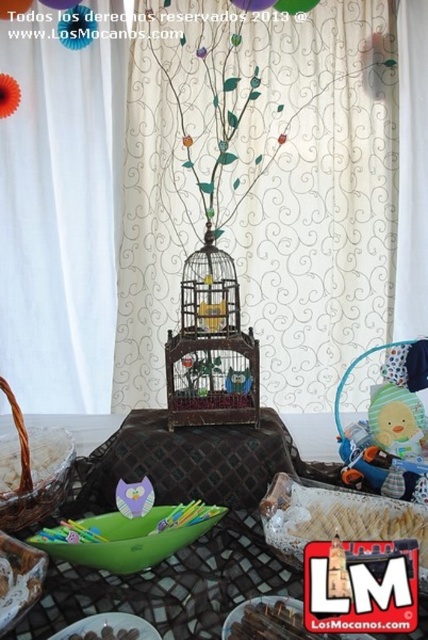
Is point (225, 253) farther from viewer compared to point (56, 3)?

That is False.

Measure the distance between metallic wire birdcage at center and translucent paper balloon at upper left.

metallic wire birdcage at center and translucent paper balloon at upper left are 5.40 feet apart from each other.

Who is more forward, (204, 259) or (53, 0)?

Point (204, 259)

Identify the location of metallic wire birdcage at center. The width and height of the screenshot is (428, 640). (211, 346).

Who is positioned more to the left, white paper balloon at upper center or purple paper balloon at upper center?

white paper balloon at upper center

Does white paper balloon at upper center appear on the left side of purple paper balloon at upper center?

Indeed, white paper balloon at upper center is positioned on the left side of purple paper balloon at upper center.

Who is more distant from viewer, (5, 8) or (258, 1)?

Point (5, 8)

This screenshot has height=640, width=428. I want to click on white paper balloon at upper center, so click(x=14, y=8).

Who is shorter, metallic wire birdcage at center or translucent plastic balloon at upper center?

translucent plastic balloon at upper center is shorter.

Based on the photo, does metallic wire birdcage at center have a smaller size compared to translucent plastic balloon at upper center?

No.

You are a GUI agent. You are given a task and a screenshot of the screen. Output one action in this format:
    pyautogui.click(x=<x>, y=<y>)
    Task: Click on the metallic wire birdcage at center
    This screenshot has width=428, height=640.
    Given the screenshot: What is the action you would take?
    pyautogui.click(x=211, y=346)